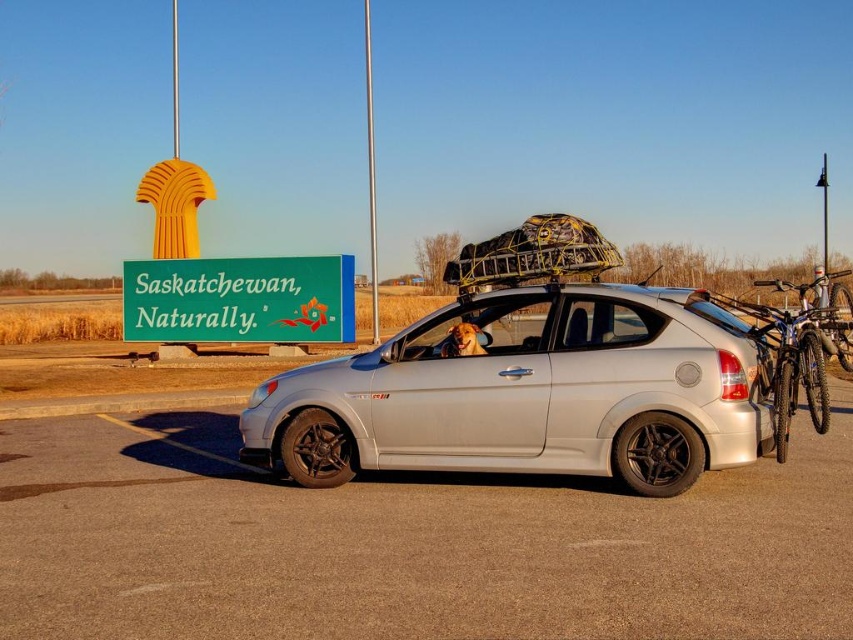
Question: Does green plastic sign at upper center appear over blue metallic bicycle at right?

Choices:
 (A) yes
 (B) no

Answer: (B)

Question: Which of the following is the farthest from the observer?

Choices:
 (A) blue metallic bicycle at right
 (B) green plastic sign at upper center

Answer: (B)

Question: Can you confirm if silver metallic hatchback at center is bigger than blue metallic bicycle at right?

Choices:
 (A) no
 (B) yes

Answer: (A)

Question: Does silver metallic hatchback at center have a smaller size compared to blue metallic bicycle at right?

Choices:
 (A) no
 (B) yes

Answer: (B)

Question: Which object appears farthest from the camera in this image?

Choices:
 (A) silver metallic hatchback at center
 (B) blue metallic bicycle at right

Answer: (B)

Question: Estimate the real-world distances between objects in this image. Which object is farther from the green plastic sign at upper center?

Choices:
 (A) blue metallic bicycle at right
 (B) silver metallic hatchback at center

Answer: (A)